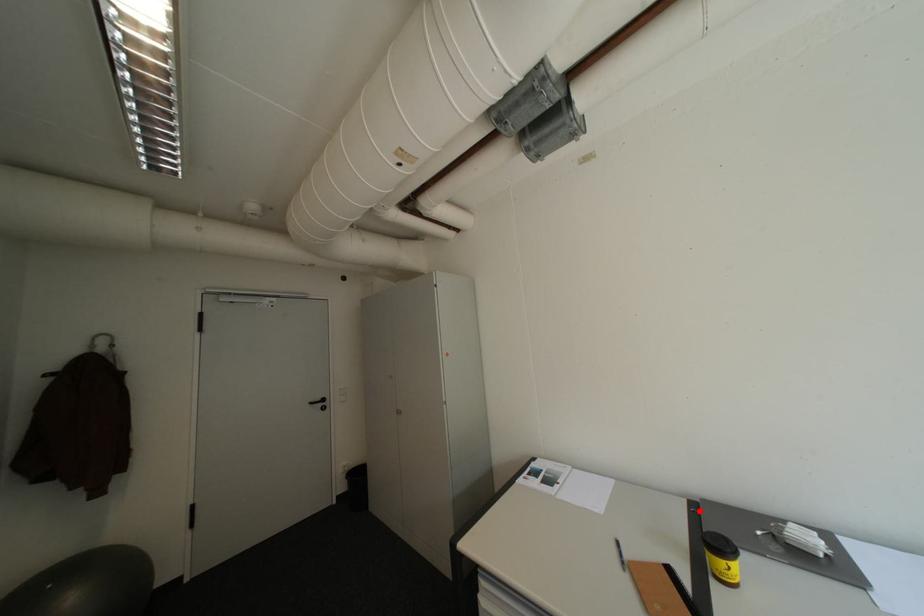
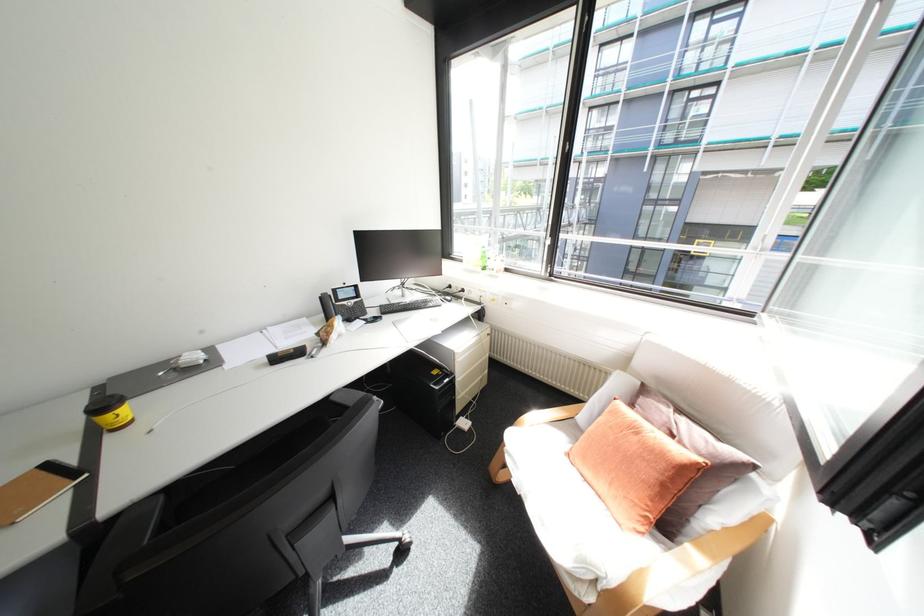
Find the pixel in the second image that matches the highlighted location in the first image.

(103, 397)